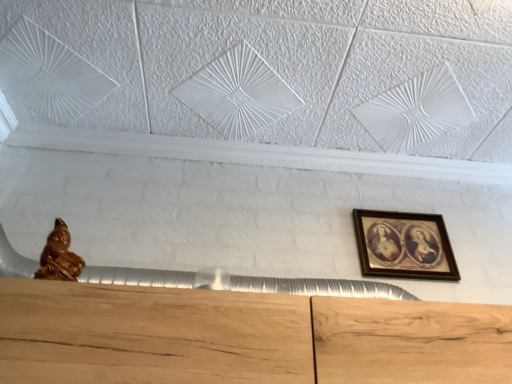
Question: Is gold polished statue at lower left spatially inside wooden framed picture at upper right, or outside of it?

Choices:
 (A) inside
 (B) outside

Answer: (B)

Question: From the image's perspective, is gold polished statue at lower left positioned above or below wooden framed picture at upper right?

Choices:
 (A) below
 (B) above

Answer: (B)

Question: Is gold polished statue at lower left taller or shorter than wooden framed picture at upper right?

Choices:
 (A) short
 (B) tall

Answer: (A)

Question: Is wooden framed picture at upper right inside or outside of gold polished statue at lower left?

Choices:
 (A) outside
 (B) inside

Answer: (A)

Question: From a real-world perspective, is wooden framed picture at upper right above or below gold polished statue at lower left?

Choices:
 (A) below
 (B) above

Answer: (B)

Question: Visually, is wooden framed picture at upper right positioned to the left or to the right of gold polished statue at lower left?

Choices:
 (A) left
 (B) right

Answer: (B)

Question: Looking at their shapes, would you say wooden framed picture at upper right is wider or thinner than gold polished statue at lower left?

Choices:
 (A) wide
 (B) thin

Answer: (B)